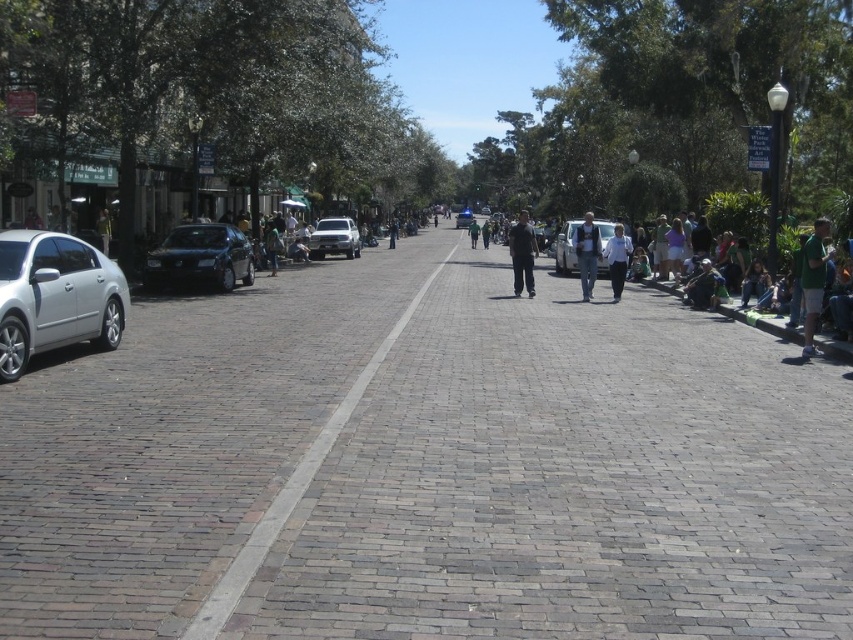
In the scene shown: You are a delivery person trying to navigate through the street. You see the brick pavement at center and the brick road at center. Which one should you follow to stay on the correct path?

You should follow the brick road at center because the brick pavement at center is to its right, indicating it might be a different section or part of the path.

You are a delivery person who needs to park your 1.8 meters tall delivery box next to the shiny black sedan at left and the silver metallic truck at center. Based on their heights, which vehicle should you place the box next to to ensure it doesn

The shiny black sedan at left has a lesser height compared to the silver metallic truck at center. Therefore, you should place the delivery box next to the silver metallic truck at center to ensure it is stable and does not topple over due to the greater height of the truck providing better support.

You are a delivery person trying to navigate a narrow path between the brick pavement at center and the brick road at center. Based on the scene description, which path is wider?

The brick pavement at center is wider than the brick road at center according to the description.